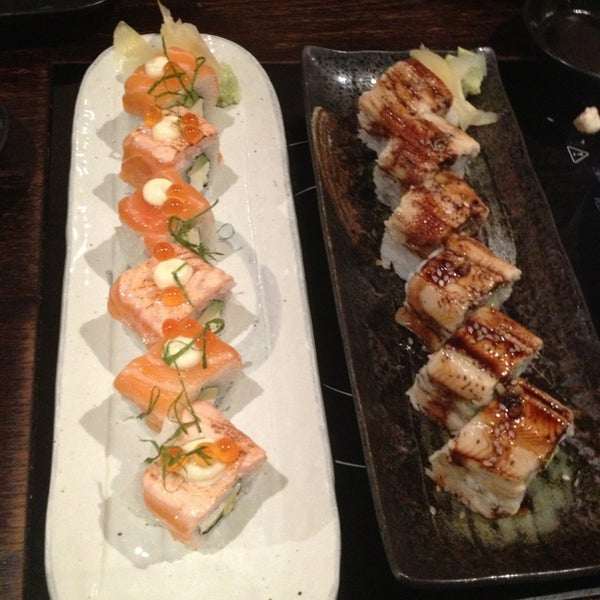
Identify the location of plate. (254, 152).